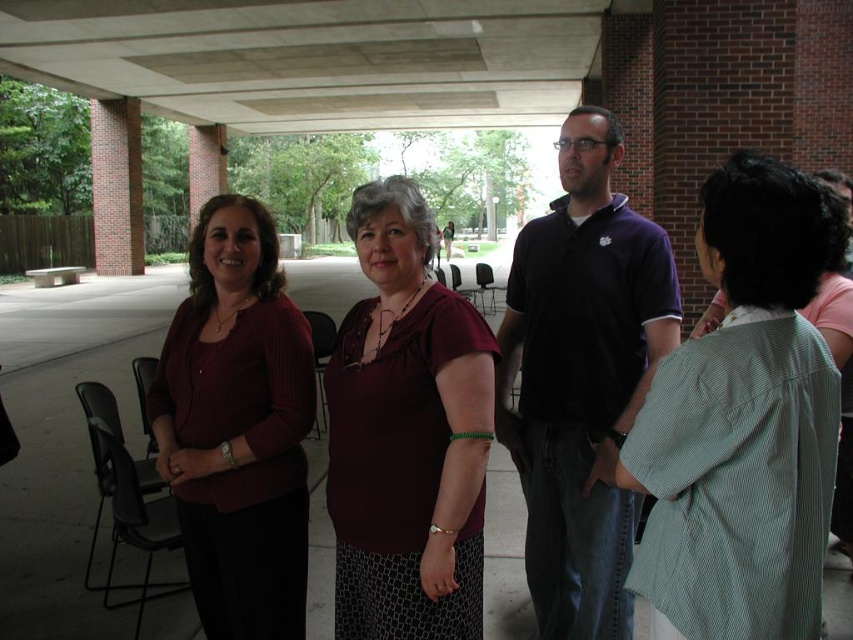
Question: Can you confirm if purple cotton polo shirt at center is bigger than matte maroon sweater at center?

Choices:
 (A) yes
 (B) no

Answer: (A)

Question: Which point is closer to the camera?

Choices:
 (A) (477, 493)
 (B) (184, 333)

Answer: (A)

Question: Is green striped shirt at center positioned behind purple cotton polo shirt at center?

Choices:
 (A) yes
 (B) no

Answer: (B)

Question: Estimate the real-world distances between objects in this image. Which object is closer to the matte maroon sweater at center?

Choices:
 (A) maroon fabric blouse at center
 (B) purple cotton polo shirt at center

Answer: (A)

Question: Can you confirm if purple cotton polo shirt at center is smaller than matte maroon sweater at center?

Choices:
 (A) yes
 (B) no

Answer: (B)

Question: Which is nearer to the matte maroon sweater at center?

Choices:
 (A) purple cotton polo shirt at center
 (B) maroon fabric blouse at center

Answer: (B)